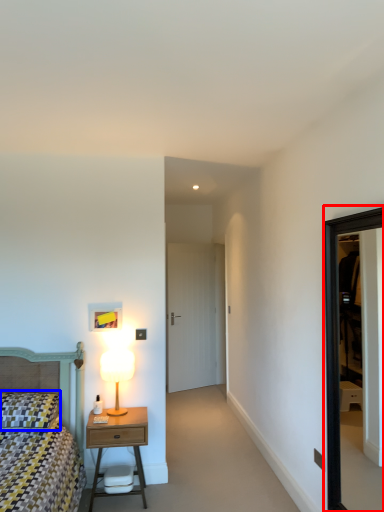
Question: Which point is closer to the camera, window (highlighted by a red box) or pillow (highlighted by a blue box)?

Choices:
 (A) window
 (B) pillow

Answer: (A)